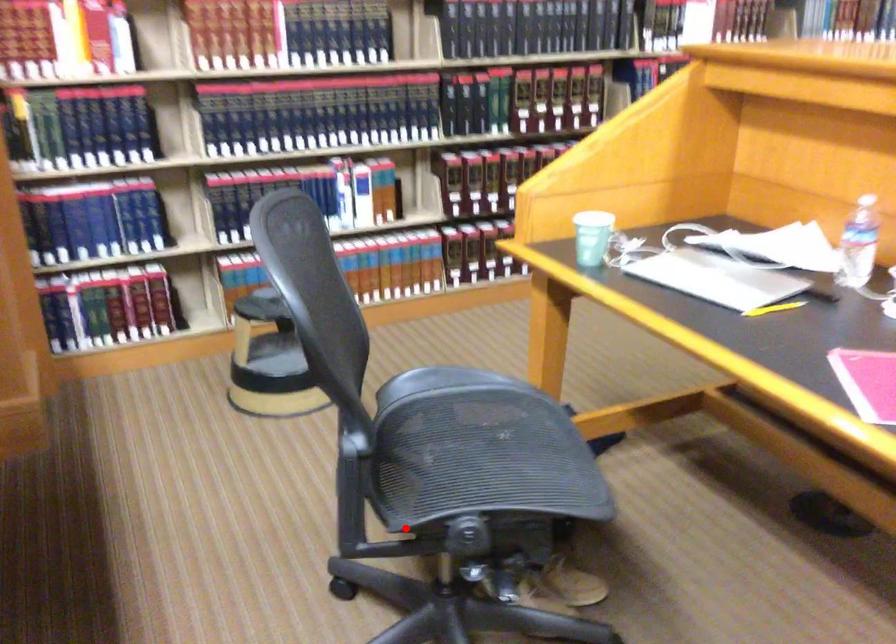
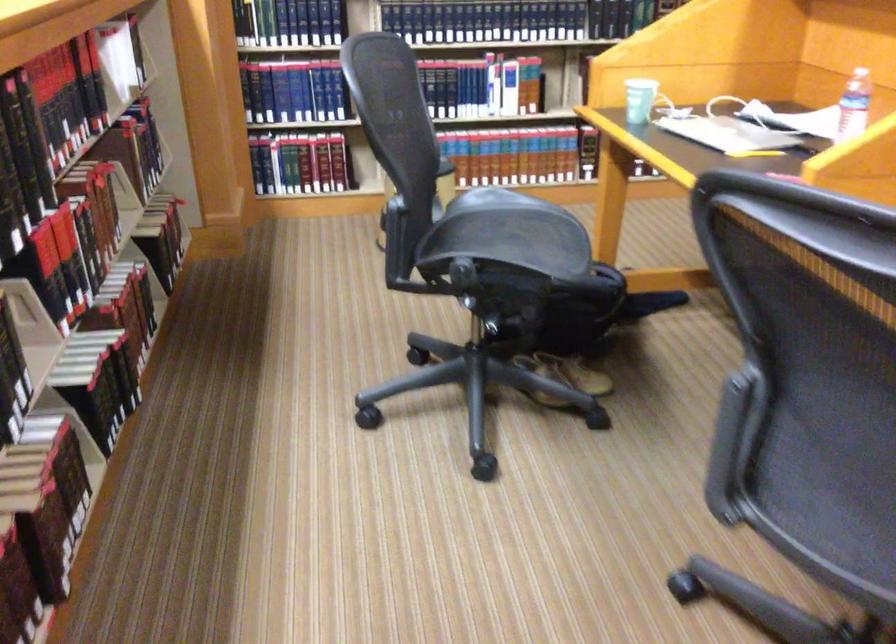
Locate, in the second image, the point that corresponds to the highlighted location in the first image.

(433, 272)